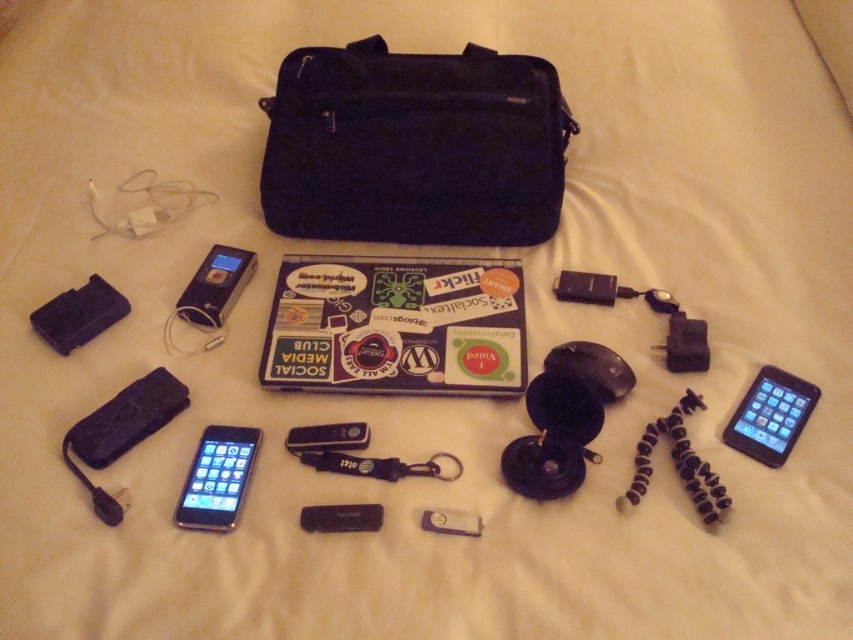
Is point (695, 476) closer to viewer compared to point (378, 461)?

That is True.

What do you see at coordinates (677, 465) in the screenshot? I see `flexible black tripod at lower right` at bounding box center [677, 465].

You are a GUI agent. You are given a task and a screenshot of the screen. Output one action in this format:
    pyautogui.click(x=<x>, y=<y>)
    Task: Click on the flexible black tripod at lower right
    This screenshot has height=640, width=853.
    Given the screenshot: What is the action you would take?
    pyautogui.click(x=677, y=465)

Does dark blue fabric bag at center lie behind satin black mp3 player at center?

Yes, dark blue fabric bag at center is behind satin black mp3 player at center.

Does point (375, 234) come in front of point (194, 312)?

No, it is not.

Identify the location of dark blue fabric bag at center. (415, 147).

Does flexible black tripod at lower right appear on the left side of satin black mp3 player at center?

In fact, flexible black tripod at lower right is to the right of satin black mp3 player at center.

Who is positioned more to the left, flexible black tripod at lower right or satin black mp3 player at center?

Positioned to the left is satin black mp3 player at center.

Describe the element at coordinates (677, 465) in the screenshot. I see `flexible black tripod at lower right` at that location.

You are a GUI agent. You are given a task and a screenshot of the screen. Output one action in this format:
    pyautogui.click(x=<x>, y=<y>)
    Task: Click on the flexible black tripod at lower right
    The width and height of the screenshot is (853, 640).
    Given the screenshot: What is the action you would take?
    677,465